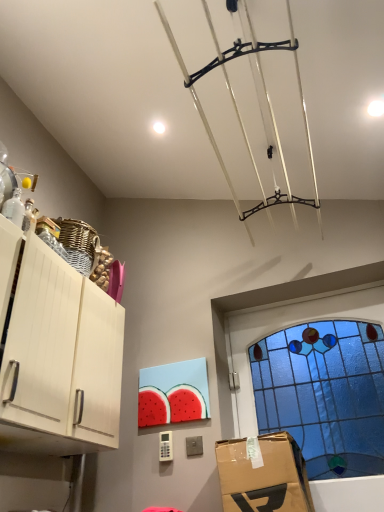
Image resolution: width=384 pixels, height=512 pixels. Find the location of `white matte cabinet at left`. white matte cabinet at left is located at coordinates (60, 360).

Describe the element at coordinates (314, 376) in the screenshot. This screenshot has width=384, height=512. I see `blue stained glass window at upper right` at that location.

Measure the distance between point (262, 335) and camera.

Point (262, 335) and camera are 8.02 feet apart from each other.

Where is `white matte cabinet at left`? This screenshot has width=384, height=512. white matte cabinet at left is located at coordinates (60, 360).

Considering the sizes of objects white matte cabinet at left and transparent glass bottles at left in the image provided, who is thinner, white matte cabinet at left or transparent glass bottles at left?

transparent glass bottles at left.

Is white matte cabinet at left shorter than transparent glass bottles at left?

No.

Consider the image. Is white matte cabinet at left facing away from transparent glass bottles at left?

No, transparent glass bottles at left is not at the back of white matte cabinet at left.

Identify the location of bottle above the white matte cabinet at left (from a real-world perspective). (14, 208).

Identify the location of bottle to the left of blue stained glass window at upper right. (14, 208).

Is blue stained glass window at upper right turned away from transparent glass bottles at left?

No, blue stained glass window at upper right is not facing the opposite direction of transparent glass bottles at left.

From a real-world perspective, is blue stained glass window at upper right positioned over transparent glass bottles at left based on gravity?

No, from a real-world perspective, blue stained glass window at upper right is not over transparent glass bottles at left

Consider the image. Who is more distant, blue stained glass window at upper right or transparent glass bottles at left?

blue stained glass window at upper right is further away from the camera.

Where is `window behind the white matte cabinet at left`? The width and height of the screenshot is (384, 512). window behind the white matte cabinet at left is located at coordinates pyautogui.click(x=314, y=376).

Is white matte cabinet at left wider or thinner than blue stained glass window at upper right?

In the image, white matte cabinet at left appears to be wider than blue stained glass window at upper right.

Which object is positioned more to the left, white matte cabinet at left or blue stained glass window at upper right?

white matte cabinet at left is more to the left.

Is white matte cabinet at left facing towards blue stained glass window at upper right?

No, white matte cabinet at left is not facing towards blue stained glass window at upper right.

From the picture: From a real-world perspective, who is located lower, transparent glass bottles at left or blue stained glass window at upper right?

blue stained glass window at upper right is physically lower.

Could blue stained glass window at upper right be considered to be inside transparent glass bottles at left?

No.

From the image's perspective, does transparent glass bottles at left appear lower than blue stained glass window at upper right?

No.

Which is farther from the camera, (370, 381) or (8, 232)?

Point (370, 381)

From a real-world perspective, who is located higher, blue stained glass window at upper right or white matte cabinet at left?

white matte cabinet at left.

Considering the sizes of objects blue stained glass window at upper right and white matte cabinet at left in the image provided, who is smaller, blue stained glass window at upper right or white matte cabinet at left?

Smaller between the two is blue stained glass window at upper right.

Identify the location of cabinetry above the blue stained glass window at upper right (from the image's perspective). This screenshot has height=512, width=384. (60, 360).

Is transparent glass bottles at left facing away from white matte cabinet at left?

transparent glass bottles at left does not have its back to white matte cabinet at left.

What's the angular difference between transparent glass bottles at left and white matte cabinet at left's facing directions?

transparent glass bottles at left and white matte cabinet at left are facing 1.86 degrees away from each other.

Are transparent glass bottles at left and white matte cabinet at left far apart?

transparent glass bottles at left is actually quite close to white matte cabinet at left.

Which object is further away from the camera, transparent glass bottles at left or white matte cabinet at left?

Positioned behind is transparent glass bottles at left.

Where is `bottle on the left side of white matte cabinet at left`? The image size is (384, 512). bottle on the left side of white matte cabinet at left is located at coordinates (14, 208).

This screenshot has width=384, height=512. In order to click on window below the transparent glass bottles at left (from a real-world perspective) in this screenshot , I will do `click(314, 376)`.

Looking at the image, which one is located closer to transparent glass bottles at left, white matte cabinet at left or blue stained glass window at upper right?

white matte cabinet at left.

When comparing their distances from blue stained glass window at upper right, does white matte cabinet at left or transparent glass bottles at left seem closer?

white matte cabinet at left lies closer to blue stained glass window at upper right than the other object.

Based on their spatial positions, is transparent glass bottles at left or white matte cabinet at left further from blue stained glass window at upper right?

Among the two, transparent glass bottles at left is located further to blue stained glass window at upper right.

Considering their positions, is blue stained glass window at upper right positioned closer to white matte cabinet at left than transparent glass bottles at left?

transparent glass bottles at left.

From the image, which object appears to be nearer to white matte cabinet at left, transparent glass bottles at left or blue stained glass window at upper right?

transparent glass bottles at left.

When comparing their distances from transparent glass bottles at left, does blue stained glass window at upper right or white matte cabinet at left seem further?

blue stained glass window at upper right lies further to transparent glass bottles at left than the other object.

Image resolution: width=384 pixels, height=512 pixels. I want to click on cabinetry between transparent glass bottles at left and blue stained glass window at upper right, so click(60, 360).